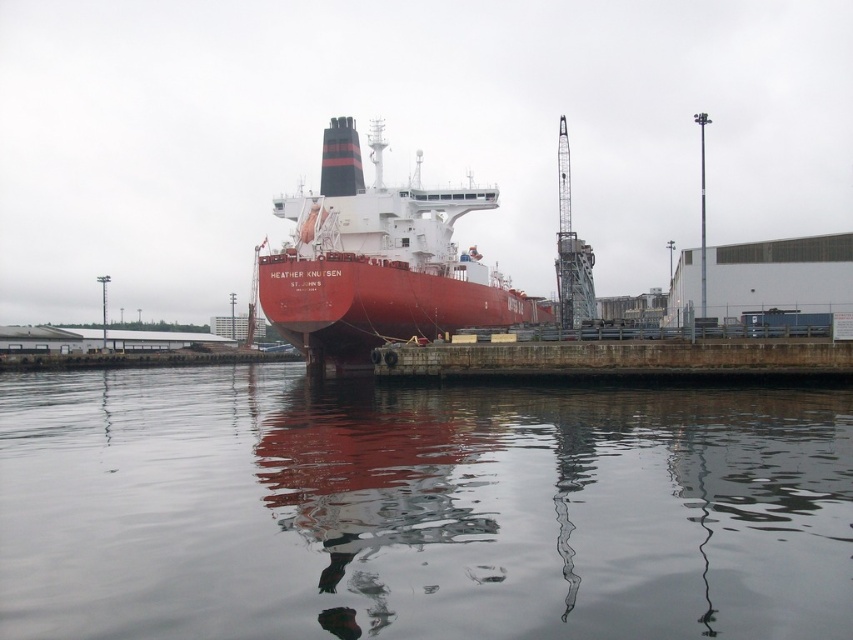
Based on the photo, is matte red ship at center shorter than concrete at center?

In fact, matte red ship at center may be taller than concrete at center.

Does matte red ship at center have a greater height compared to concrete at center?

Yes, matte red ship at center is taller than concrete at center.

From the picture: Measure the distance between matte red ship at center and camera.

matte red ship at center and camera are 272.14 feet apart from each other.

Find the location of a particular element. The image size is (853, 640). matte red ship at center is located at coordinates (378, 260).

Does smooth water at center have a lesser width compared to concrete at center?

Incorrect, smooth water at center's width is not less than concrete at center's.

Looking at this image, between smooth water at center and concrete at center, which one appears on the right side from the viewer's perspective?

concrete at center

Which is in front, point (619, 547) or point (729, 352)?

Positioned in front is point (619, 547).

I want to click on smooth water at center, so click(x=418, y=508).

Who is positioned more to the right, smooth water at center or matte red ship at center?

From the viewer's perspective, matte red ship at center appears more on the right side.

Is smooth water at center bigger than matte red ship at center?

Actually, smooth water at center might be smaller than matte red ship at center.

In order to click on smooth water at center in this screenshot , I will do `click(418, 508)`.